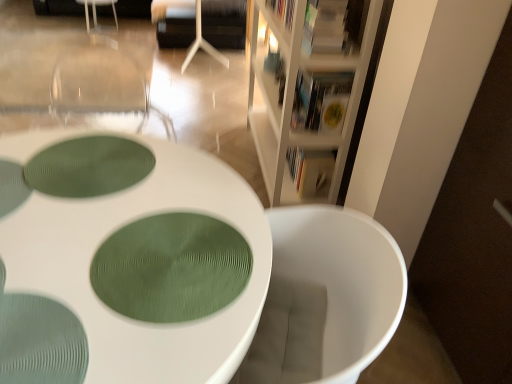
At what (x,y) coordinates should I click in order to perform the action: click on vacant space in green textured placemat at center, placed as the 2th oval when sorted from bottom to top (from a real-world perspective). Please return your answer as a coordinate pair (x, y). Image resolution: width=512 pixels, height=384 pixels. Looking at the image, I should click on (93, 170).